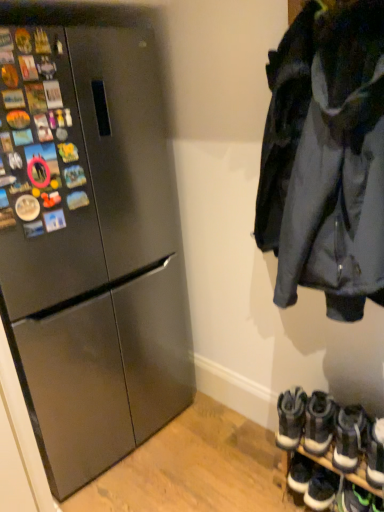
Question: Considering the relative sizes of dark gray fabric jacket at upper right and white rubber sneakers at lower right, which is counted as the 3th footwear, starting from the right, in the image provided, is dark gray fabric jacket at upper right bigger than white rubber sneakers at lower right, which is counted as the 3th footwear, starting from the right,?

Choices:
 (A) no
 (B) yes

Answer: (B)

Question: Is dark gray fabric jacket at upper right oriented towards white rubber sneakers at lower right, which is counted as the 3th footwear, starting from the right?

Choices:
 (A) yes
 (B) no

Answer: (B)

Question: From a real-world perspective, is dark gray fabric jacket at upper right physically below white rubber sneakers at lower right, which is counted as the 3th footwear, starting from the right?

Choices:
 (A) no
 (B) yes

Answer: (A)

Question: From the image's perspective, would you say dark gray fabric jacket at upper right is shown under white rubber sneakers at lower right, which is the fifth footwear from left to right?

Choices:
 (A) yes
 (B) no

Answer: (B)

Question: Does dark gray fabric jacket at upper right have a greater width compared to white rubber sneakers at lower right, which is counted as the 3th footwear, starting from the right?

Choices:
 (A) yes
 (B) no

Answer: (A)

Question: Is point (185, 373) closer or farther from the camera than point (344, 485)?

Choices:
 (A) closer
 (B) farther

Answer: (B)

Question: In the image, is satin black refrigerator at left positioned in front of or behind green suede sneakers at lower right, placed as the 2th footwear when sorted from right to left?

Choices:
 (A) front
 (B) behind

Answer: (A)

Question: Is satin black refrigerator at left to the left or to the right of green suede sneakers at lower right, placed as the sixth footwear when sorted from left to right, in the image?

Choices:
 (A) left
 (B) right

Answer: (A)

Question: From the image's perspective, is satin black refrigerator at left positioned above or below green suede sneakers at lower right, placed as the 2th footwear when sorted from right to left?

Choices:
 (A) above
 (B) below

Answer: (A)

Question: Does point (314, 284) appear closer or farther from the camera than point (291, 430)?

Choices:
 (A) closer
 (B) farther

Answer: (A)

Question: In the image, is dark gray fabric jacket at upper right positioned in front of or behind white suede sneakers at lower right, the 1th footwear positioned from the left?

Choices:
 (A) front
 (B) behind

Answer: (A)

Question: In terms of height, does dark gray fabric jacket at upper right look taller or shorter compared to white suede sneakers at lower right, the seventh footwear viewed from the right?

Choices:
 (A) tall
 (B) short

Answer: (A)

Question: In terms of width, does dark gray fabric jacket at upper right look wider or thinner when compared to white suede sneakers at lower right, the 1th footwear positioned from the left?

Choices:
 (A) thin
 (B) wide

Answer: (B)

Question: Looking at their shapes, would you say white leather sneakers at lower right, the 2th footwear from the left, is wider or thinner than dark gray fabric jacket at upper right?

Choices:
 (A) wide
 (B) thin

Answer: (B)

Question: From the image's perspective, is white leather sneakers at lower right, the 2th footwear from the left, positioned above or below dark gray fabric jacket at upper right?

Choices:
 (A) below
 (B) above

Answer: (A)